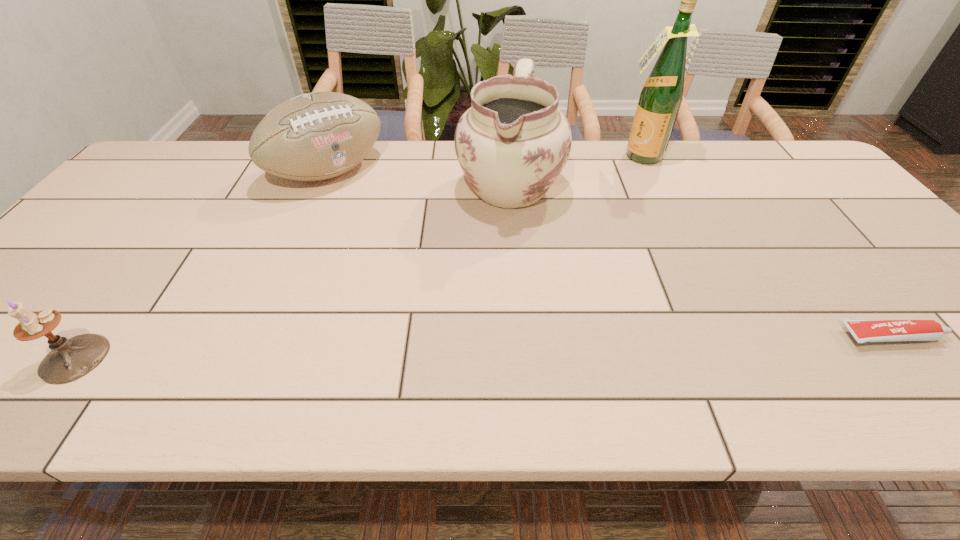
Find the location of a particular element. vacant space at the far right corner of the desktop is located at coordinates (777, 146).

Identify the location of empty location between the liquor and the toothpaste. The height and width of the screenshot is (540, 960). (766, 246).

Where is `vacant region between the second tallest object and the candle holder`? The image size is (960, 540). vacant region between the second tallest object and the candle holder is located at coordinates (292, 272).

You are a GUI agent. You are given a task and a screenshot of the screen. Output one action in this format:
    pyautogui.click(x=<x>, y=<y>)
    Task: Click on the vacant space in between the tallest object and the leftmost object
    This screenshot has width=960, height=540.
    Given the screenshot: What is the action you would take?
    pyautogui.click(x=357, y=257)

The height and width of the screenshot is (540, 960). I want to click on free space between the fourth tallest object and the fourth object from right to left, so click(202, 265).

Identify the location of free space that is in between the fourth shortest object and the football (American). click(x=419, y=179).

Identify the location of vacant point located between the second object from right to left and the candle holder. (357, 257).

You are a GUI agent. You are given a task and a screenshot of the screen. Output one action in this format:
    pyautogui.click(x=<x>, y=<y>)
    Task: Click on the free space between the tallest object and the pitcher
    
    Given the screenshot: What is the action you would take?
    pyautogui.click(x=574, y=171)

Identify the location of unoccupied position between the tallest object and the second tallest object. The width and height of the screenshot is (960, 540). (574, 171).

Select which object is the closest to the fourth object from left to right. Please provide its 2D coordinates. Your answer should be formatted as a tuple, i.e. [(x, y)], where the tuple contains the x and y coordinates of a point satisfying the conditions above.

[(513, 142)]